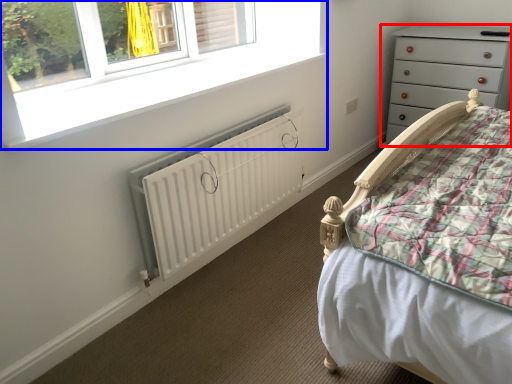
Question: Which of the following is the farthest to the observer, chest of drawers (highlighted by a red box) or window (highlighted by a blue box)?

Choices:
 (A) chest of drawers
 (B) window

Answer: (A)